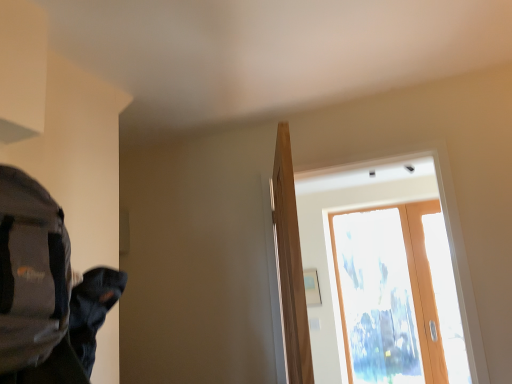
Question: Considering the positions of transparent glass door at upper center and transparent glass door at upper right in the image, is transparent glass door at upper center taller or shorter than transparent glass door at upper right?

Choices:
 (A) tall
 (B) short

Answer: (A)

Question: From the image's perspective, is transparent glass door at upper center positioned above or below transparent glass door at upper right?

Choices:
 (A) above
 (B) below

Answer: (B)

Question: Which object is the farthest from the transparent glass door at upper center?

Choices:
 (A) transparent glass door at upper right
 (B) gray fabric backpack at left
 (C) light brown wood door at center

Answer: (B)

Question: Which of these objects is positioned farthest from the gray fabric backpack at left?

Choices:
 (A) transparent glass door at upper center
 (B) light brown wood door at center
 (C) transparent glass door at upper right

Answer: (A)